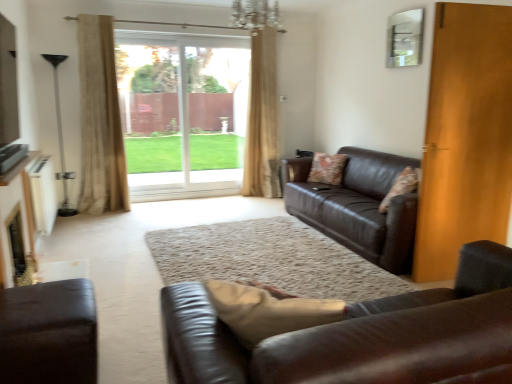
Question: Considering the relative sizes of fluffy fabric pillow at right, which is counted as the 1th pillow, starting from the right, and beige textured curtain at center, which appears as the second curtain when viewed from the left, in the image provided, is fluffy fabric pillow at right, which is counted as the 1th pillow, starting from the right, shorter than beige textured curtain at center, which appears as the second curtain when viewed from the left,?

Choices:
 (A) no
 (B) yes

Answer: (B)

Question: Is fluffy fabric pillow at right, the second pillow when ordered from left to right, to the left of beige textured curtain at center, the second curtain positioned from the front, from the viewer's perspective?

Choices:
 (A) no
 (B) yes

Answer: (A)

Question: Is fluffy fabric pillow at right, the second pillow when ordered from left to right, directly adjacent to beige textured curtain at center, which appears as the 1th curtain when viewed from the right?

Choices:
 (A) no
 (B) yes

Answer: (A)

Question: Does fluffy fabric pillow at right, the second pillow when ordered from left to right, turn towards beige textured curtain at center, which appears as the second curtain when viewed from the left?

Choices:
 (A) yes
 (B) no

Answer: (B)

Question: From a real-world perspective, is fluffy fabric pillow at right, which is counted as the 1th pillow, starting from the right, located higher than beige textured curtain at center, marked as the 1th curtain in a back-to-front arrangement?

Choices:
 (A) yes
 (B) no

Answer: (B)

Question: Does fluffy fabric pillow at right, positioned as the second pillow in back-to-front order, have a lesser width compared to beige textured curtain at center, marked as the 1th curtain in a back-to-front arrangement?

Choices:
 (A) yes
 (B) no

Answer: (B)

Question: Is matte brown leather couch at right, the 1th studio couch from the back, further to camera compared to beige textured curtain at left, which is the 2th curtain from back to front?

Choices:
 (A) yes
 (B) no

Answer: (B)

Question: From a real-world perspective, is matte brown leather couch at right, the 1th studio couch from the back, physically above beige textured curtain at left, arranged as the 1th curtain when viewed from the front?

Choices:
 (A) no
 (B) yes

Answer: (A)

Question: Can you confirm if matte brown leather couch at right, the 1th studio couch from the back, is wider than beige textured curtain at left, arranged as the 1th curtain when viewed from the front?

Choices:
 (A) no
 (B) yes

Answer: (B)

Question: Is matte brown leather couch at right, which ranks as the 3th studio couch in front-to-back order, at the left side of beige textured curtain at left, arranged as the 1th curtain when viewed from the front?

Choices:
 (A) no
 (B) yes

Answer: (A)

Question: Is matte brown leather couch at right, which ranks as the 3th studio couch in front-to-back order, to the right of beige textured curtain at left, arranged as the 1th curtain when viewed from the front, from the viewer's perspective?

Choices:
 (A) yes
 (B) no

Answer: (A)

Question: From the image's perspective, is matte brown leather couch at right, which ranks as the 3th studio couch in front-to-back order, above beige textured curtain at left, arranged as the 1th curtain when viewed from the front?

Choices:
 (A) no
 (B) yes

Answer: (A)

Question: From the image's perspective, is matte brown leather couch at right, which ranks as the 3th studio couch in front-to-back order, over leather couch at center, marked as the 1th studio couch in a front-to-back arrangement?

Choices:
 (A) no
 (B) yes

Answer: (B)